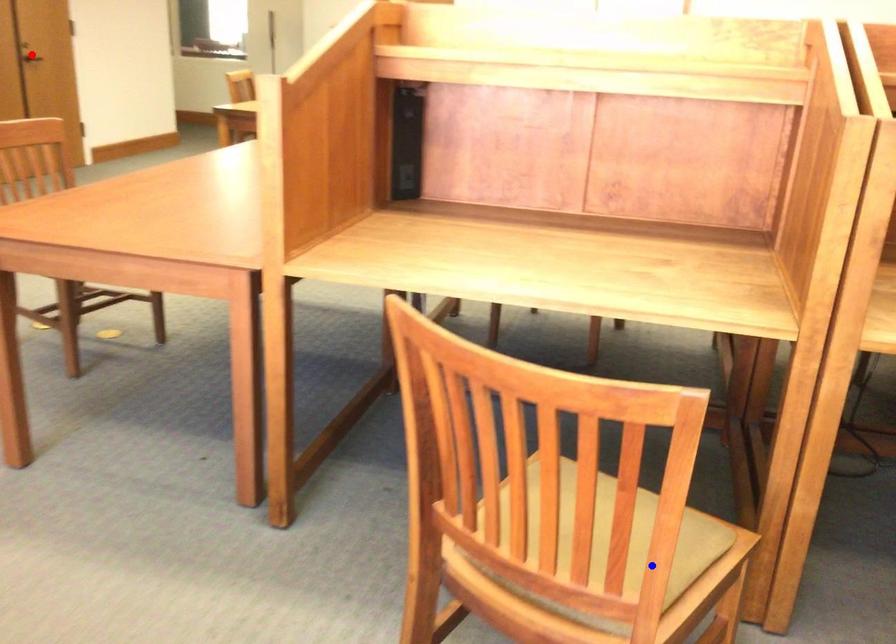
Question: Which of the two points in the image is closer to the camera?

Choices:
 (A) Blue point is closer.
 (B) Red point is closer.

Answer: (A)